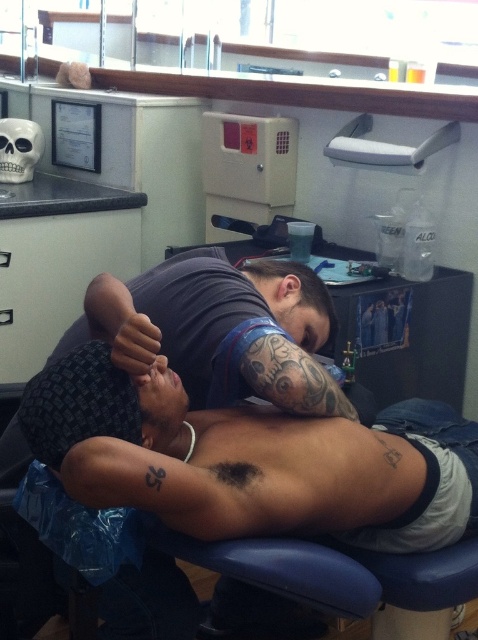
Question: Can you confirm if tattooed skin at upper center is positioned below white matte skull at upper left?

Choices:
 (A) no
 (B) yes

Answer: (B)

Question: Which is nearer to the white matte skull at upper left?

Choices:
 (A) dark skin tattooed arm at center
 (B) tattooed skin at upper center
 (C) black ink tattoo at center
 (D) black skin muscle at center

Answer: (A)

Question: Which point is closer to the camera?

Choices:
 (A) black skin muscle at center
 (B) white matte skull at upper left

Answer: (A)

Question: From the image, what is the correct spatial relationship of black skin muscle at center in relation to black ink tattoo at lower left?

Choices:
 (A) left
 (B) right

Answer: (B)

Question: Which point appears farthest from the camera in this image?

Choices:
 (A) (100, 493)
 (B) (8, 161)
 (C) (216, 465)
 (D) (289, 508)

Answer: (B)

Question: Can you confirm if tattooed skin at upper center is smaller than dark skin tattooed arm at center?

Choices:
 (A) no
 (B) yes

Answer: (A)